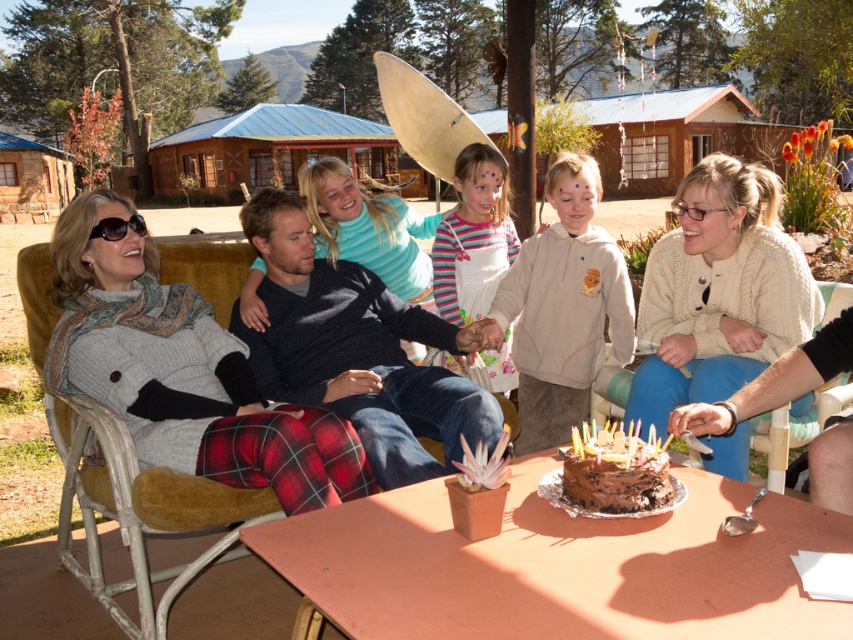
You are taking a photo of the birthday celebration. There are two points in the scene, one at coordinate point (91, 385) and the other at point (770, 182). Which point will appear closer to the camera in the photo?

Point (91, 385) is closer to the camera than point (770, 182), so it will appear closer in the photo.

You are a photographer standing behind the table. You want to take a photo of the dark blue sweater at center and the velvet yellow chair at left. Can you fit both in your camera frame if your camera has a maximum horizontal field of view of 30 inches?

The distance between the dark blue sweater at center and the velvet yellow chair at left is 28.75 inches, which is within the camera frame of 30 inches. Yes, both can be captured in the photo.